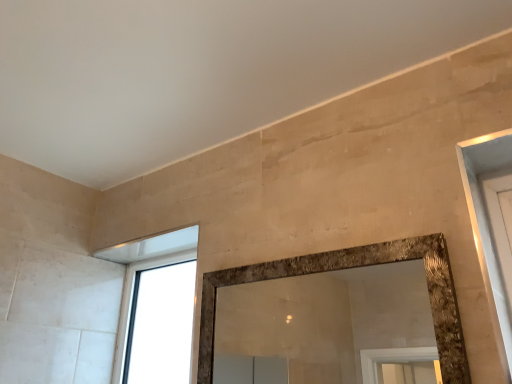
What do you see at coordinates (156, 308) in the screenshot? I see `transparent glass window at upper left` at bounding box center [156, 308].

Where is `transparent glass window at upper left`? The height and width of the screenshot is (384, 512). transparent glass window at upper left is located at coordinates pos(156,308).

In order to face beige stone wall at upper center, should I rotate leftwards or rightwards?

Turn left approximately 13.343 degrees to face it.

This screenshot has width=512, height=384. I want to click on beige stone wall at upper center, so click(x=198, y=70).

What do you see at coordinates (198, 70) in the screenshot? I see `beige stone wall at upper center` at bounding box center [198, 70].

What is the approximate height of beige stone wall at upper center?

1.54 inches.

Find the location of a particular element. The height and width of the screenshot is (384, 512). transparent glass window at upper left is located at coordinates (156, 308).

Looking at this image, does beige stone wall at upper center appear on the right side of transparent glass window at upper left?

Correct, you'll find beige stone wall at upper center to the right of transparent glass window at upper left.

Is beige stone wall at upper center closer to the viewer compared to transparent glass window at upper left?

Yes, it is.

Which is farther, (63,120) or (183,239)?

Positioned behind is point (183,239).

From the image's perspective, is beige stone wall at upper center on top of transparent glass window at upper left?

Correct, beige stone wall at upper center appears higher than transparent glass window at upper left in the image.

From a real-world perspective, which object rests below the other?

transparent glass window at upper left, from a real-world perspective.

Considering the relative sizes of beige stone wall at upper center and transparent glass window at upper left in the image provided, is beige stone wall at upper center wider than transparent glass window at upper left?

Yes.

Does beige stone wall at upper center have a greater height compared to transparent glass window at upper left?

In fact, beige stone wall at upper center may be shorter than transparent glass window at upper left.

Considering the relative sizes of beige stone wall at upper center and transparent glass window at upper left in the image provided, is beige stone wall at upper center bigger than transparent glass window at upper left?

Yes, beige stone wall at upper center is bigger than transparent glass window at upper left.

Is transparent glass window at upper left inside beige stone wall at upper center?

No, transparent glass window at upper left is not inside beige stone wall at upper center.

Is beige stone wall at upper center far from transparent glass window at upper left?

No, beige stone wall at upper center is in close proximity to transparent glass window at upper left.

Is beige stone wall at upper center facing towards transparent glass window at upper left?

No, beige stone wall at upper center is not aimed at transparent glass window at upper left.

How different are the orientations of beige stone wall at upper center and transparent glass window at upper left in degrees?

The facing directions of beige stone wall at upper center and transparent glass window at upper left are 0.804 degrees apart.

Measure the distance between beige stone wall at upper center and transparent glass window at upper left.

beige stone wall at upper center and transparent glass window at upper left are 22.58 inches apart.

The image size is (512, 384). I want to click on window below the beige stone wall at upper center (from the image's perspective), so click(156, 308).

Based on their positions, is transparent glass window at upper left located to the left or right of beige stone wall at upper center?

transparent glass window at upper left is to the left of beige stone wall at upper center.

Which is behind, transparent glass window at upper left or beige stone wall at upper center?

transparent glass window at upper left is behind.

Is point (170, 310) closer to camera compared to point (325, 14)?

No, it is behind (325, 14).

From the image's perspective, is transparent glass window at upper left beneath beige stone wall at upper center?

Yes, from the image's perspective, transparent glass window at upper left is below beige stone wall at upper center.

From a real-world perspective, is transparent glass window at upper left located higher than beige stone wall at upper center?

Actually, transparent glass window at upper left is physically below beige stone wall at upper center in the real world.

Considering the relative sizes of transparent glass window at upper left and beige stone wall at upper center in the image provided, is transparent glass window at upper left wider than beige stone wall at upper center?

No, transparent glass window at upper left is not wider than beige stone wall at upper center.

Considering the sizes of transparent glass window at upper left and beige stone wall at upper center in the image, is transparent glass window at upper left taller or shorter than beige stone wall at upper center?

transparent glass window at upper left is taller than beige stone wall at upper center.

In terms of size, does transparent glass window at upper left appear bigger or smaller than beige stone wall at upper center?

In the image, transparent glass window at upper left appears to be smaller than beige stone wall at upper center.

Is transparent glass window at upper left situated inside beige stone wall at upper center or outside?

transparent glass window at upper left is located beyond the bounds of beige stone wall at upper center.

Can you see transparent glass window at upper left touching beige stone wall at upper center?

transparent glass window at upper left is not next to beige stone wall at upper center, and they're not touching.

Is transparent glass window at upper left positioned with its back to beige stone wall at upper center?

No, transparent glass window at upper left's orientation is not away from beige stone wall at upper center.

Can you tell me how much transparent glass window at upper left and beige stone wall at upper center differ in facing direction?

0.804 degrees.

You are a GUI agent. You are given a task and a screenshot of the screen. Output one action in this format:
    pyautogui.click(x=<x>, y=<y>)
    Task: Click on the backdrop that appears in front of the transparent glass window at upper left
    The width and height of the screenshot is (512, 384).
    Given the screenshot: What is the action you would take?
    pyautogui.click(x=198, y=70)

Where is `backdrop that is on the right side of transparent glass window at upper left`? Image resolution: width=512 pixels, height=384 pixels. backdrop that is on the right side of transparent glass window at upper left is located at coordinates coord(198,70).

At what (x,y) coordinates should I click in order to perform the action: click on window below the beige stone wall at upper center (from the image's perspective). Please return your answer as a coordinate pair (x, y). This screenshot has width=512, height=384. Looking at the image, I should click on (156, 308).